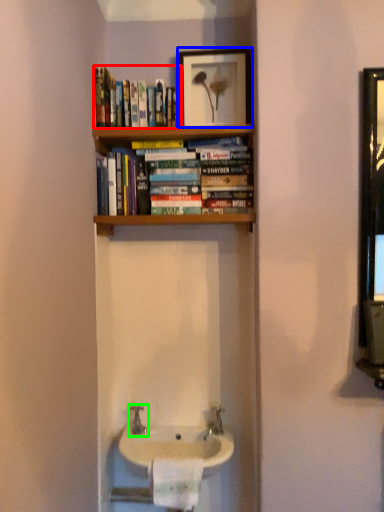
Question: Based on their relative distances, which object is nearer to book (highlighted by a red box)? Choose from picture frame (highlighted by a blue box) and tap (highlighted by a green box).

Choices:
 (A) picture frame
 (B) tap

Answer: (A)